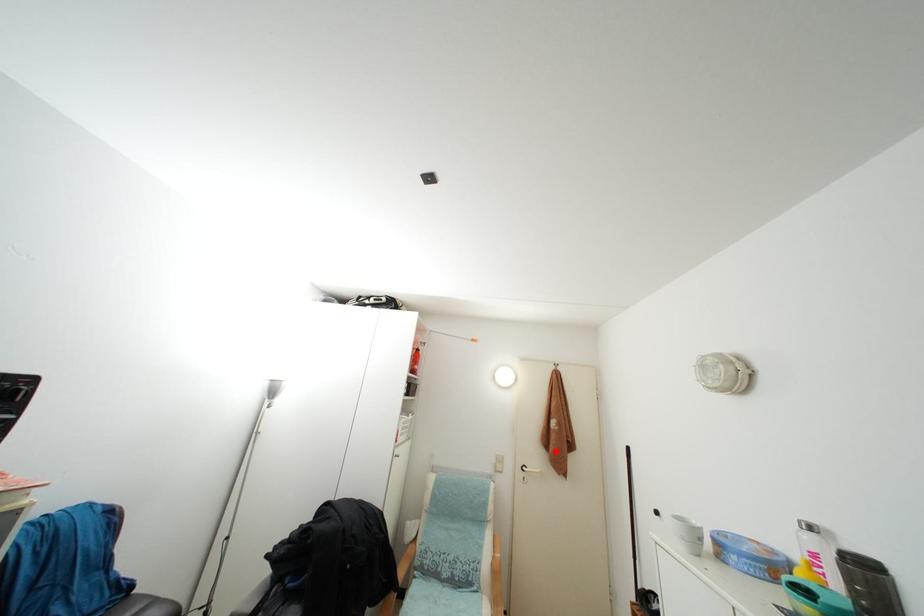
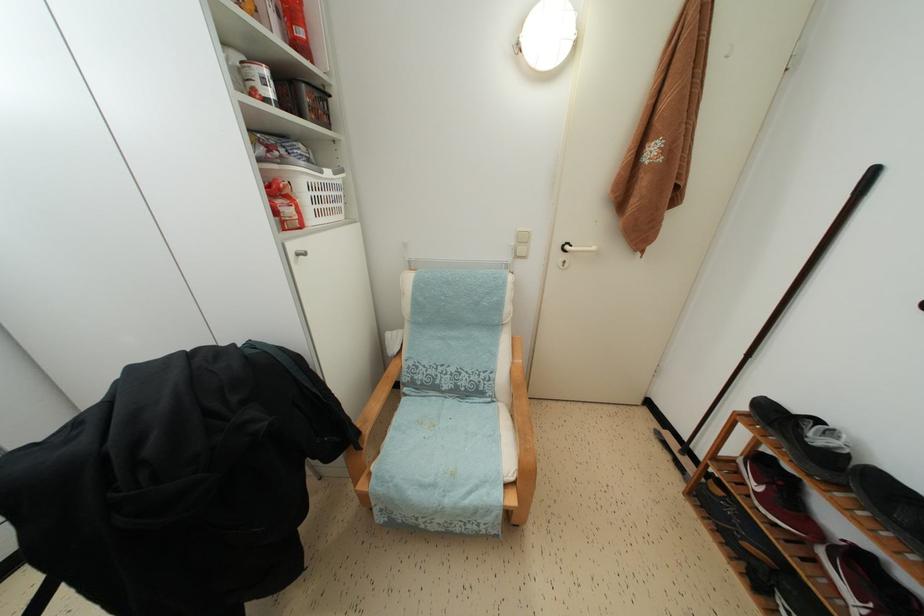
Where in the second image is the point corresponding to the highlighted location from the first image?

(638, 207)